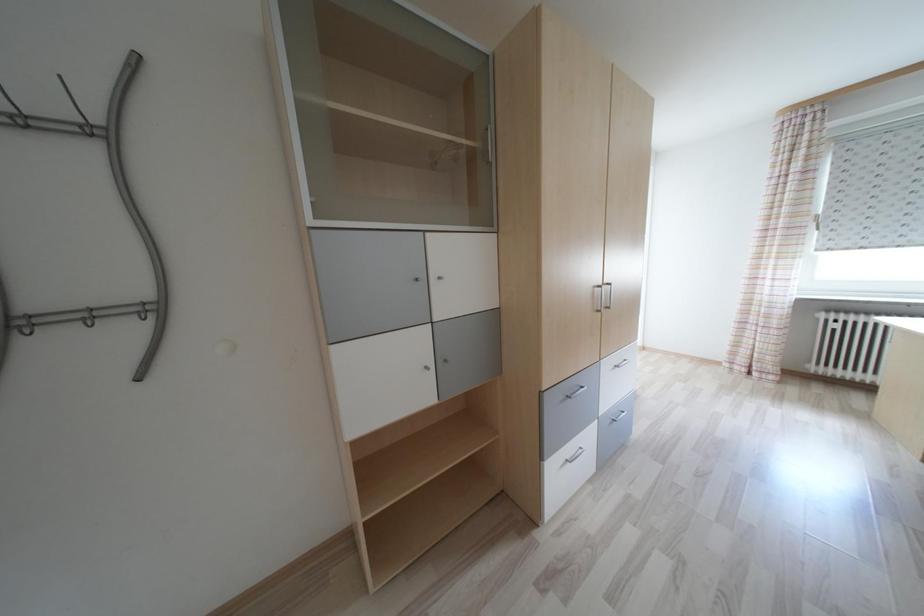
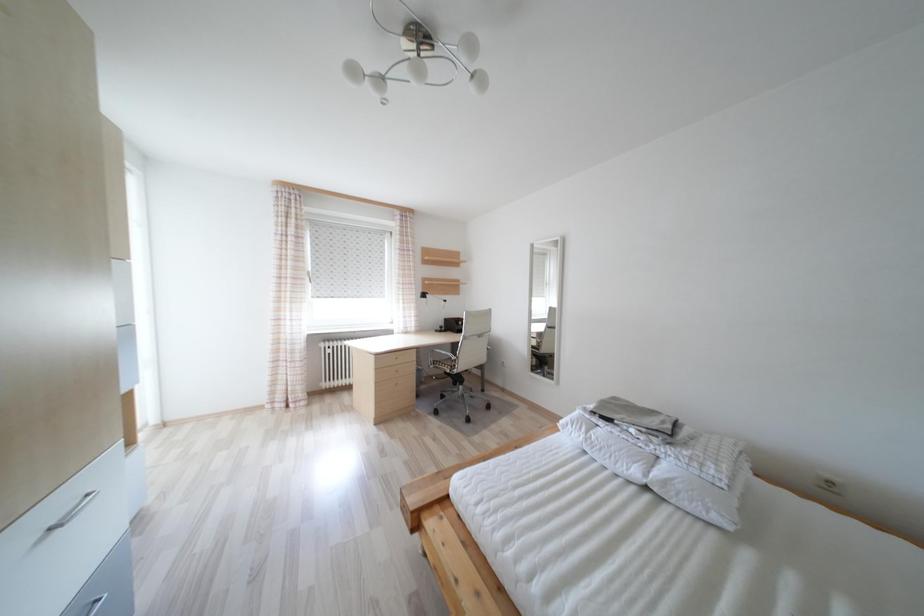
Question: Based on the continuous images, in which direction is the camera rotating? Reply with the corresponding letter.

Choices:
 (A) Left
 (B) Right
 (C) Up
 (D) Down

Answer: (B)